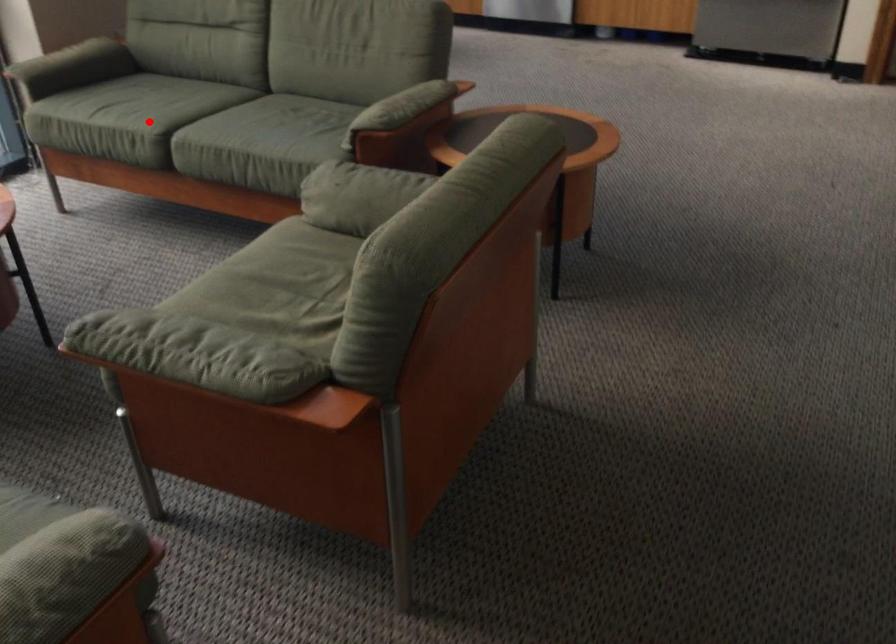
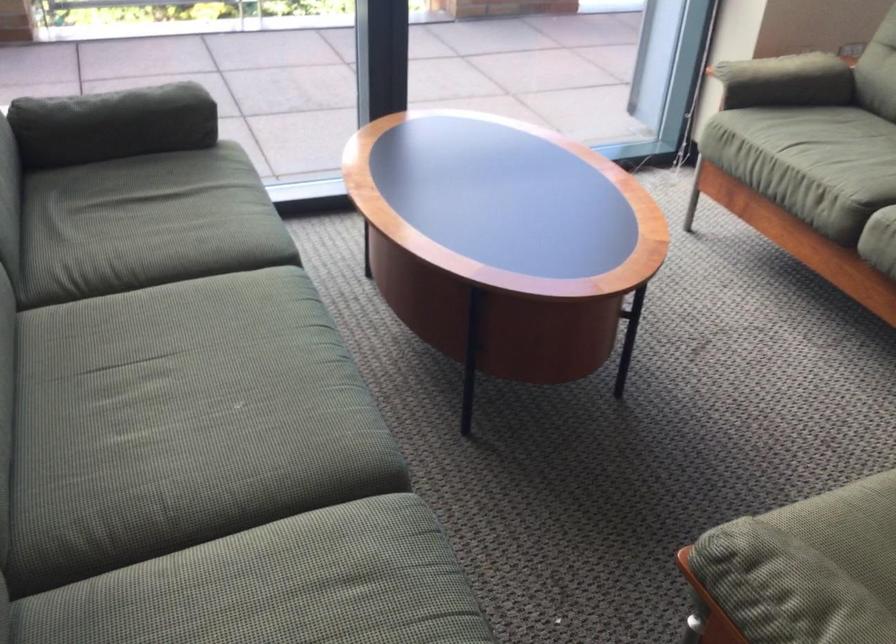
Find the pixel in the second image that matches the highlighted location in the first image.

(846, 180)